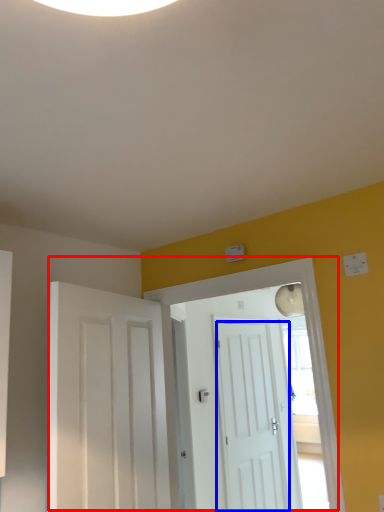
Question: Which object appears farthest to the camera in this image, door (highlighted by a red box) or door (highlighted by a blue box)?

Choices:
 (A) door
 (B) door

Answer: (B)